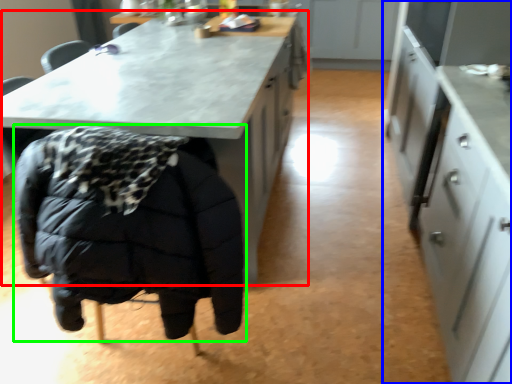
Question: Which object is the closest to the table (highlighted by a red box)? Choose among these: cabinetry (highlighted by a blue box) or jacket (highlighted by a green box).

Choices:
 (A) cabinetry
 (B) jacket

Answer: (B)